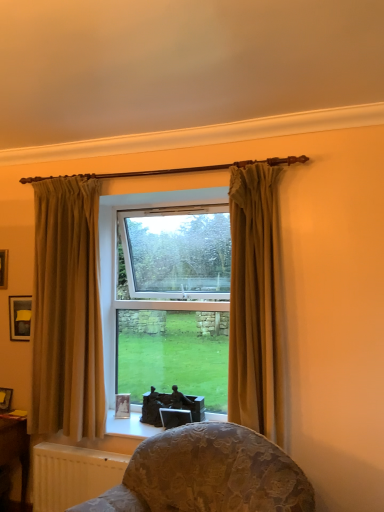
Question: Considering the positions of point (1, 392) and point (82, 490), is point (1, 392) closer or farther from the camera than point (82, 490)?

Choices:
 (A) farther
 (B) closer

Answer: (A)

Question: From a real-world perspective, is matte black picture frame at lower left, the 2th picture frame from the left, physically located above or below white textured radiator at lower left?

Choices:
 (A) above
 (B) below

Answer: (A)

Question: Which object is the farthest from the matte black picture frame at upper left, placed as the first picture frame when sorted from left to right?

Choices:
 (A) white textured radiator at lower left
 (B) matte gold curtain at center, which is the 1th curtain in front-to-back order
 (C) matte glass window at center
 (D) wooden table at lower left
 (E) matte silver picture frame at lower center, which is counted as the 4th picture frame, starting from the left

Answer: (B)

Question: Which of these objects is positioned closest to the matte beige curtain at left, placed as the 1th curtain when sorted from left to right?

Choices:
 (A) matte silver picture frame at lower center, which is counted as the first picture frame, starting from the right
 (B) matte glass window at center
 (C) matte gold curtain at center, which is the 1th curtain from right to left
 (D) wooden table at lower left
 (E) matte black picture frame at upper left, the 2th picture frame when ordered from top to bottom

Answer: (E)